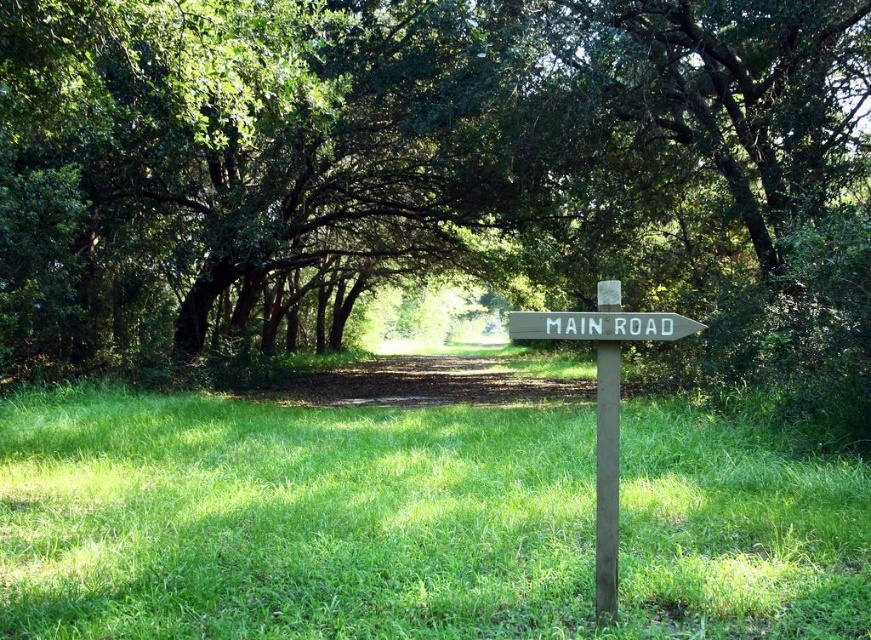
Question: Among these points, which one is nearest to the camera?

Choices:
 (A) (721, 221)
 (B) (604, 524)
 (C) (566, 326)
 (D) (606, 417)

Answer: (D)

Question: Is green grassy field at center thinner than wooden signpost at center?

Choices:
 (A) no
 (B) yes

Answer: (A)

Question: Can you confirm if green grassy field at center is positioned to the right of white wooden sign at center?

Choices:
 (A) yes
 (B) no

Answer: (B)

Question: Which object appears farthest from the camera in this image?

Choices:
 (A) white wooden sign at center
 (B) wooden signpost at center
 (C) green wood pole at center

Answer: (C)

Question: Which object is the farthest from the wooden signpost at center?

Choices:
 (A) green leafy tree at center
 (B) green wood pole at center
 (C) white wooden sign at center
 (D) green grassy field at center

Answer: (A)

Question: Does green leafy tree at center have a greater width compared to wooden signpost at center?

Choices:
 (A) no
 (B) yes

Answer: (B)